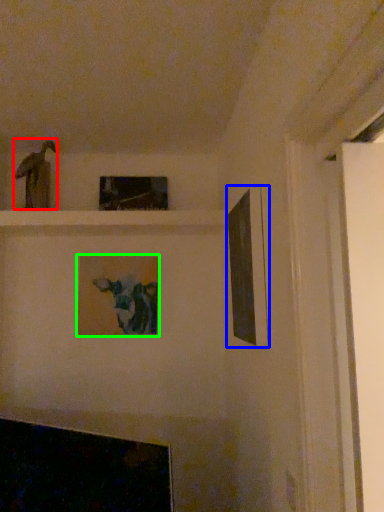
Question: Estimate the real-world distances between objects in this image. Which object is farther from art (highlighted by a red box), picture frame (highlighted by a blue box) or picture frame (highlighted by a green box)?

Choices:
 (A) picture frame
 (B) picture frame

Answer: (A)